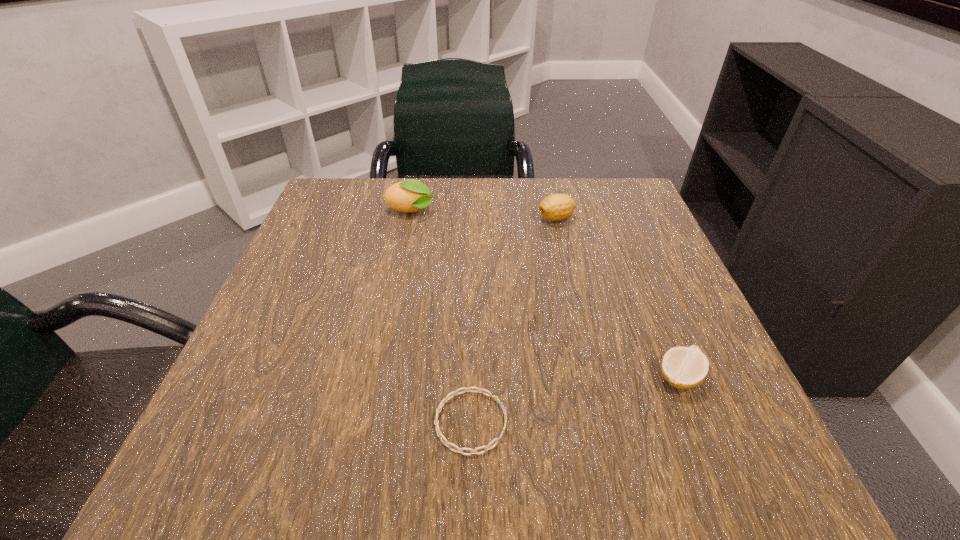
The width and height of the screenshot is (960, 540). I want to click on vacant space in between the bracelet and the tallest object, so click(x=441, y=316).

Find the location of a particular element. The width and height of the screenshot is (960, 540). vacant space in between the second shortest lemon and the shortest object is located at coordinates (514, 320).

Where is `free point between the leftmost lemon and the second object from left to right`? The image size is (960, 540). free point between the leftmost lemon and the second object from left to right is located at coordinates (441, 316).

At what (x,y) coordinates should I click in order to perform the action: click on free space between the rightmost lemon and the leftmost object. Please return your answer as a coordinate pair (x, y). Looking at the image, I should click on tap(545, 294).

Select which object is the closest to the second tallest lemon. Please provide its 2D coordinates. Your answer should be formatted as a tuple, i.e. [(x, y)], where the tuple contains the x and y coordinates of a point satisfying the conditions above.

[(411, 195)]

In order to click on object that is the closest to the second object from left to right in this screenshot , I will do `click(684, 368)`.

Where is `lemon that stands as the closest to the rightmost lemon`? lemon that stands as the closest to the rightmost lemon is located at coordinates point(556,207).

Locate which lemon ranks second in proximity to the leftmost lemon. Please provide its 2D coordinates. Your answer should be formatted as a tuple, i.e. [(x, y)], where the tuple contains the x and y coordinates of a point satisfying the conditions above.

[(684, 368)]

Locate an element on the screen. The height and width of the screenshot is (540, 960). free space that satisfies the following two spatial constraints: 1. with leaves positioned above the tallest object; 2. on the left side of the second shortest object is located at coordinates (376, 377).

You are a GUI agent. You are given a task and a screenshot of the screen. Output one action in this format:
    pyautogui.click(x=<x>, y=<y>)
    Task: Click on the free location that satisfies the following two spatial constraints: 1. at the stem end of the second shortest object; 2. on the left side of the second tallest object
    The image size is (960, 540).
    Given the screenshot: What is the action you would take?
    pyautogui.click(x=592, y=377)